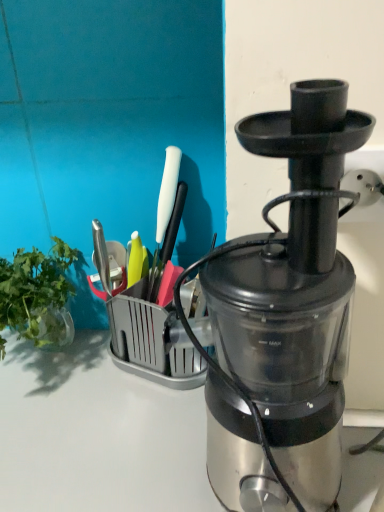
Question: From a real-world perspective, relative to green leafy vegetable at left, is metallic silver blender at center vertically above or below?

Choices:
 (A) below
 (B) above

Answer: (B)

Question: Considering the positions of metallic silver blender at center and green leafy vegetable at left in the image, is metallic silver blender at center wider or thinner than green leafy vegetable at left?

Choices:
 (A) wide
 (B) thin

Answer: (B)

Question: Would you say metallic silver blender at center is inside or outside green leafy vegetable at left?

Choices:
 (A) inside
 (B) outside

Answer: (B)

Question: From a real-world perspective, is green leafy vegetable at left positioned above or below metallic silver blender at center?

Choices:
 (A) above
 (B) below

Answer: (B)

Question: Considering their positions, is green leafy vegetable at left located in front of or behind metallic silver blender at center?

Choices:
 (A) front
 (B) behind

Answer: (B)

Question: From the image's perspective, is green leafy vegetable at left above or below metallic silver blender at center?

Choices:
 (A) above
 (B) below

Answer: (B)

Question: Looking at the image, does green leafy vegetable at left seem bigger or smaller compared to metallic silver blender at center?

Choices:
 (A) big
 (B) small

Answer: (B)